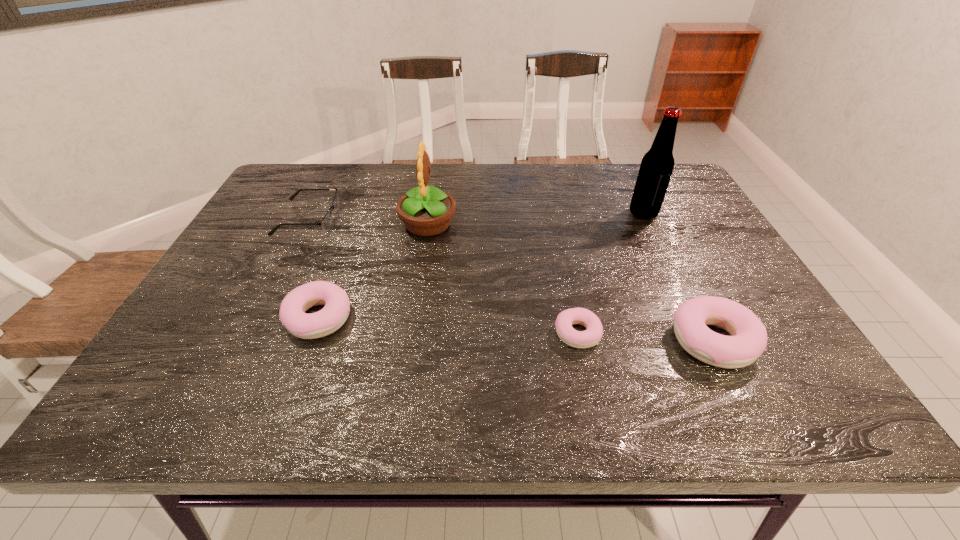
Please point a space for a new pastry to maintain equal intervals. Please provide its 2D coordinates. Your answer should be formatted as a tuple, i.e. [(x, y)], where the tuple contains the x and y coordinates of a point satisfying the conditions above.

[(446, 326)]